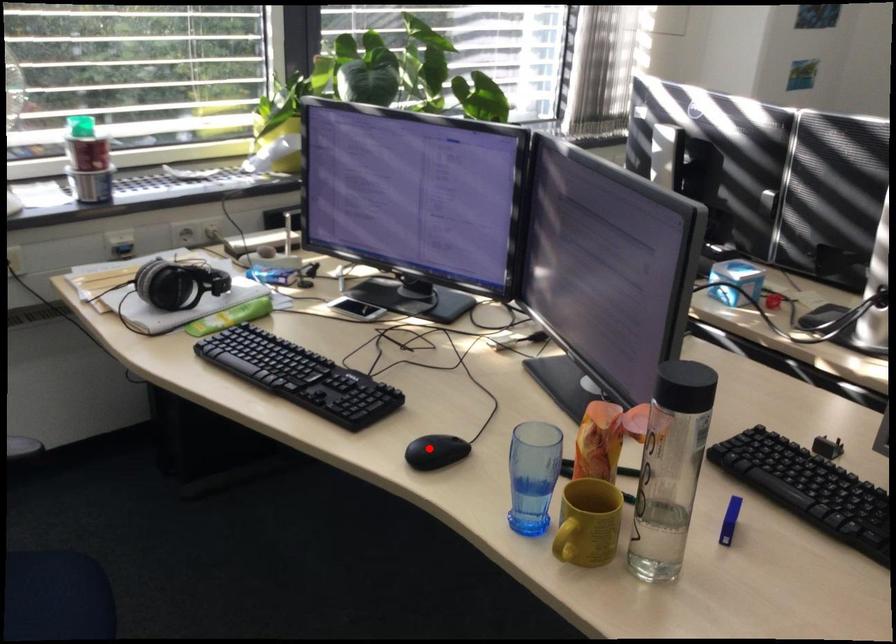
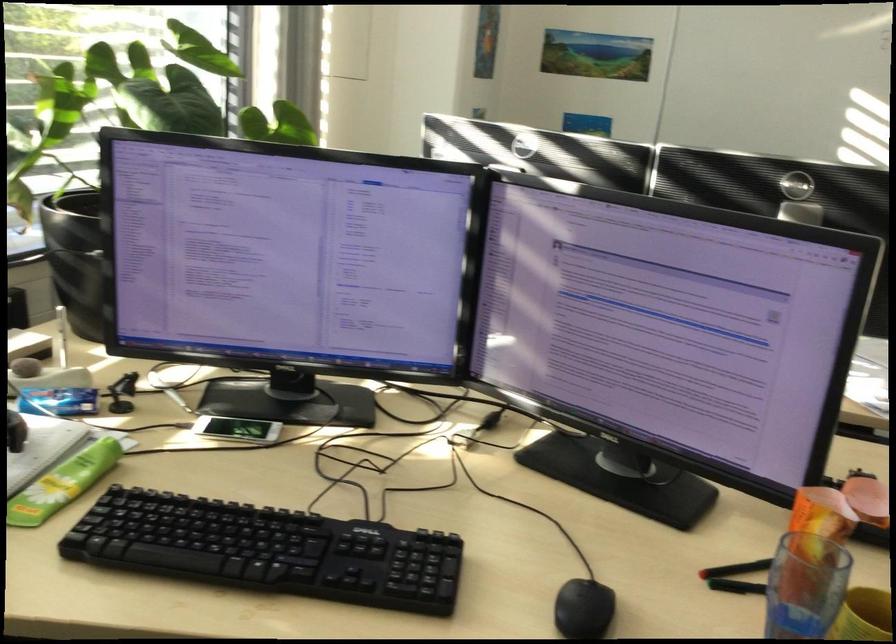
Find the pixel in the second image that matches the highlighted location in the first image.

(583, 609)